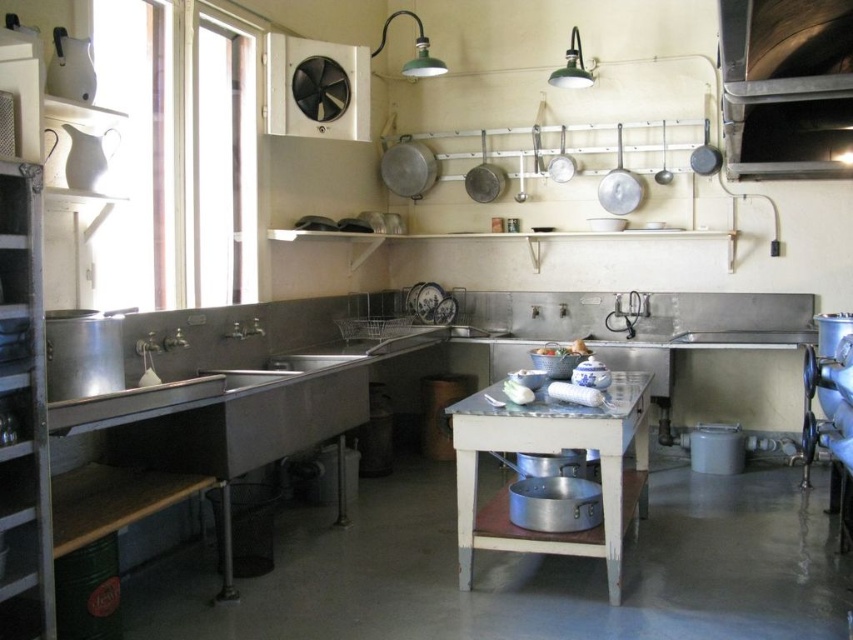
Is metallic silver exhaust hood at upper right taller than metallic silver table at center?

No.

Does metallic silver exhaust hood at upper right appear over metallic silver table at center?

Indeed, metallic silver exhaust hood at upper right is positioned over metallic silver table at center.

Describe the element at coordinates (785, 84) in the screenshot. The height and width of the screenshot is (640, 853). I see `metallic silver exhaust hood at upper right` at that location.

Locate an element on the screen. The image size is (853, 640). metallic silver exhaust hood at upper right is located at coordinates (785, 84).